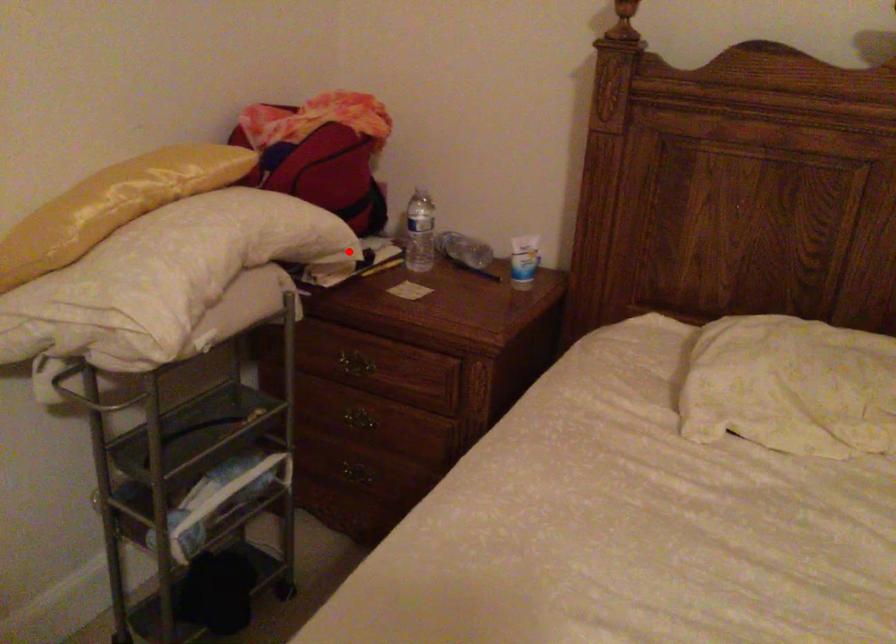
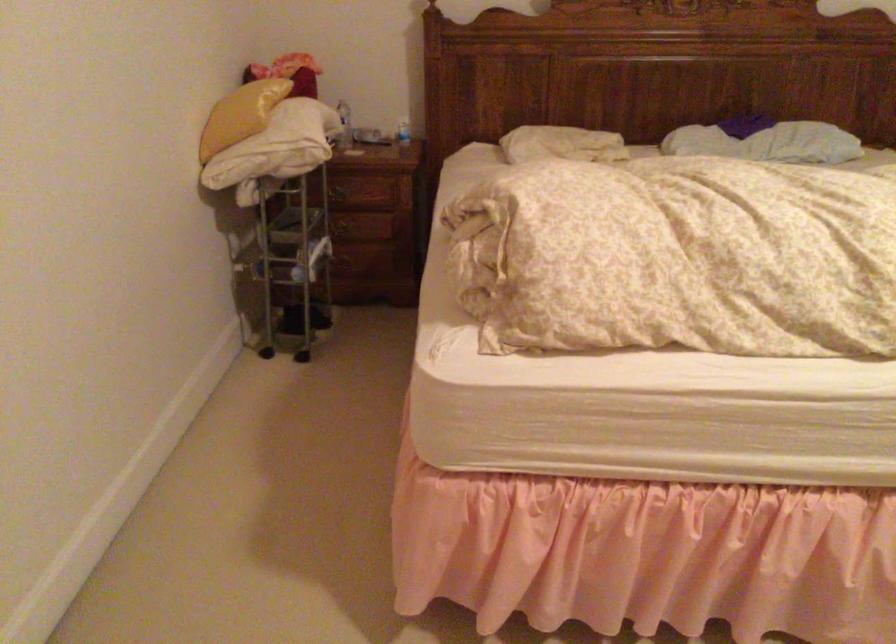
In the second image, find the point that corresponds to the highlighted location in the first image.

(343, 125)